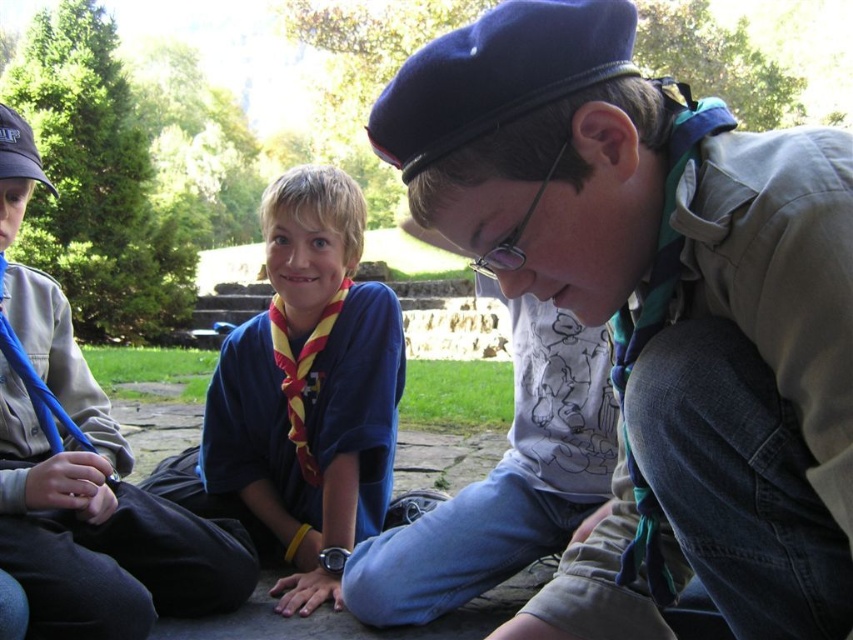
What is located at the coordinates point [657,307] in the image?

The point [657,307] is on the matte khaki shirt at center.